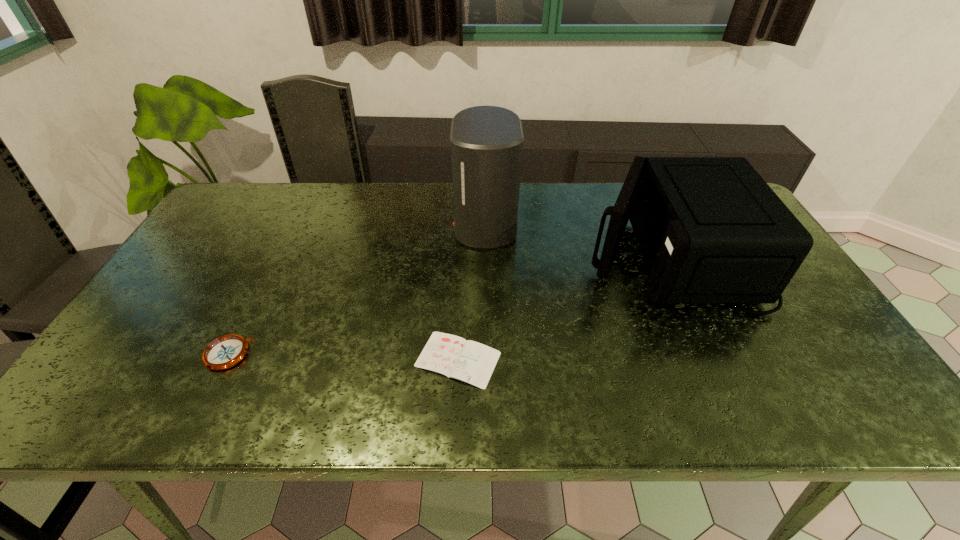
Locate an element on the screen. Image resolution: width=960 pixels, height=540 pixels. coffee maker is located at coordinates (486, 142).

This screenshot has height=540, width=960. In order to click on microwave oven in this screenshot , I will do `click(712, 231)`.

In order to click on the rightmost object in this screenshot , I will do `click(712, 231)`.

Locate an element on the screen. This screenshot has width=960, height=540. the leftmost object is located at coordinates (226, 351).

This screenshot has width=960, height=540. In order to click on compass in this screenshot , I will do `click(226, 351)`.

Find the location of a particular element. diary is located at coordinates (455, 357).

Find the location of `vacant space located on the button side of the tallest object`. vacant space located on the button side of the tallest object is located at coordinates (431, 224).

Locate an element on the screen. Image resolution: width=960 pixels, height=540 pixels. vacant space situated on the button side of the tallest object is located at coordinates (364, 224).

This screenshot has height=540, width=960. In order to click on vacant space located on the button side of the tallest object in this screenshot , I will do `click(370, 224)`.

Find the location of `vacant region located with the door open on the rightmost object`. vacant region located with the door open on the rightmost object is located at coordinates (478, 253).